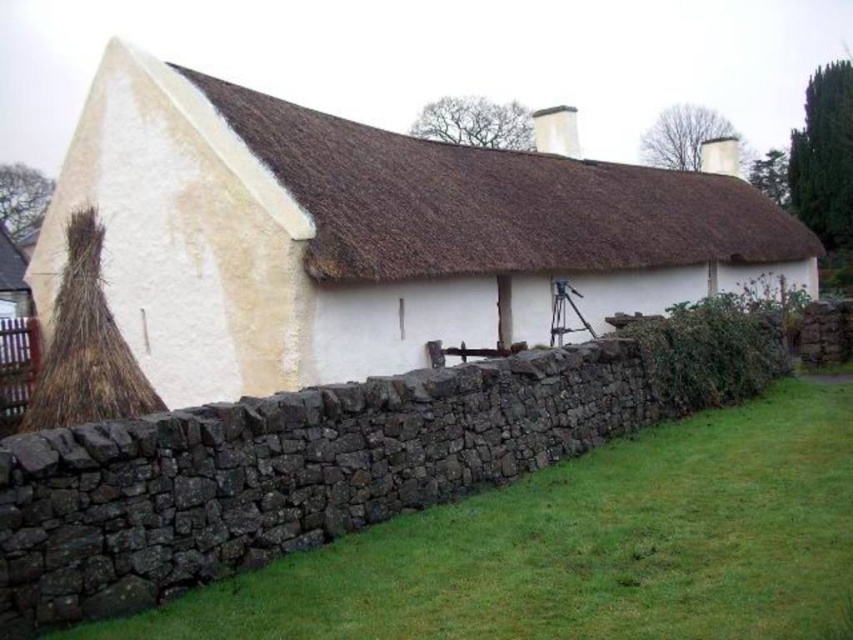
Looking at this image, who is higher up, white stucco cottage at center or green grass at lower right?

white stucco cottage at center

Which of these two, white stucco cottage at center or green grass at lower right, stands shorter?

Standing shorter between the two is green grass at lower right.

Measure the distance between point (607, 285) and camera.

Point (607, 285) is 74.96 feet from camera.

Locate an element on the screen. The image size is (853, 640). white stucco cottage at center is located at coordinates (364, 236).

Can you confirm if white stucco cottage at center is shorter than brown thatch roof at center?

Incorrect, white stucco cottage at center's height does not fall short of brown thatch roof at center's.

Consider the image. Is the position of white stucco cottage at center less distant than that of brown thatch roof at center?

No, white stucco cottage at center is behind brown thatch roof at center.

Is point (682, 294) positioned in front of point (244, 108)?

No, it is behind (244, 108).

At what (x,y) coordinates should I click in order to perform the action: click on white stucco cottage at center. Please return your answer as a coordinate pair (x, y). The width and height of the screenshot is (853, 640). Looking at the image, I should click on (364, 236).

Is point (817, 417) more distant than point (646, 230)?

No, it is not.

Measure the distance between green grass at lower right and brown thatch roof at center.

They are 40.14 feet apart.

Describe the element at coordinates (583, 547) in the screenshot. This screenshot has height=640, width=853. I see `green grass at lower right` at that location.

The image size is (853, 640). In order to click on green grass at lower right in this screenshot , I will do `click(583, 547)`.